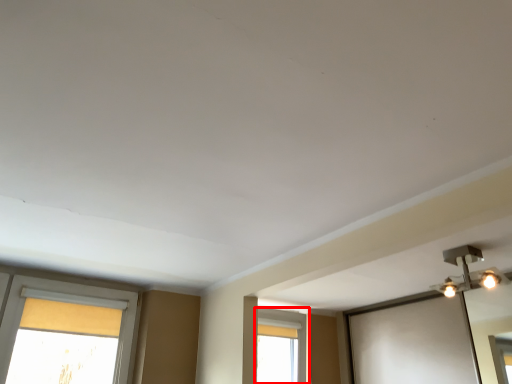
Question: From the image's perspective, what is the correct spatial positioning of window (annotated by the red box) in reference to light fixture?

Choices:
 (A) above
 (B) below

Answer: (B)